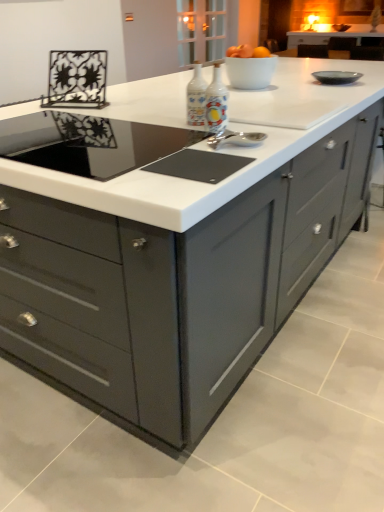
The width and height of the screenshot is (384, 512). What are the coordinates of `vacant space in front of porcelain bottles at center, which is the second appliance from left to right` in the screenshot? It's located at (x=227, y=140).